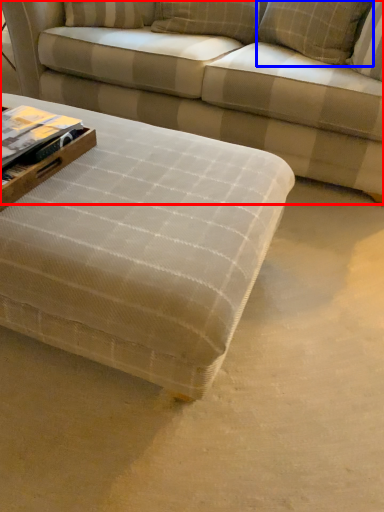
Question: Which object appears closest to the camera in this image, studio couch (highlighted by a red box) or pillow (highlighted by a blue box)?

Choices:
 (A) studio couch
 (B) pillow

Answer: (A)